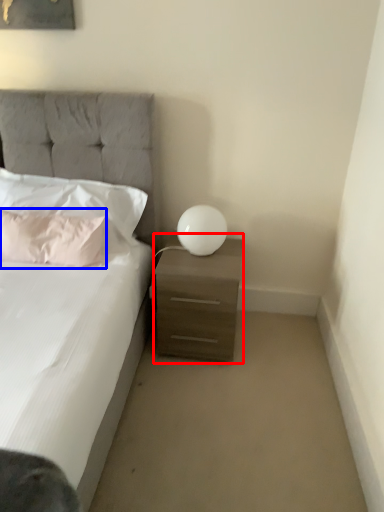
Question: Which of the following is the farthest to the observer, nightstand (highlighted by a red box) or pillow (highlighted by a blue box)?

Choices:
 (A) nightstand
 (B) pillow

Answer: (B)